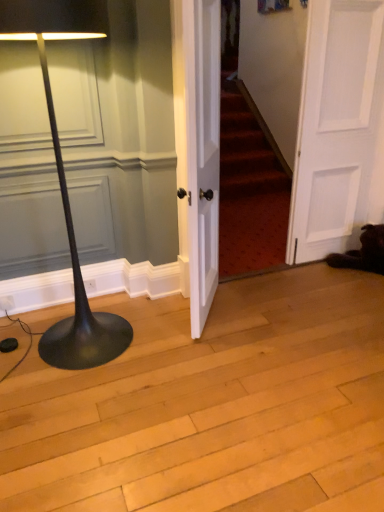
This screenshot has width=384, height=512. What are the coordinates of `vacant space in front of black matte floor lamp at left` in the screenshot? It's located at (77, 402).